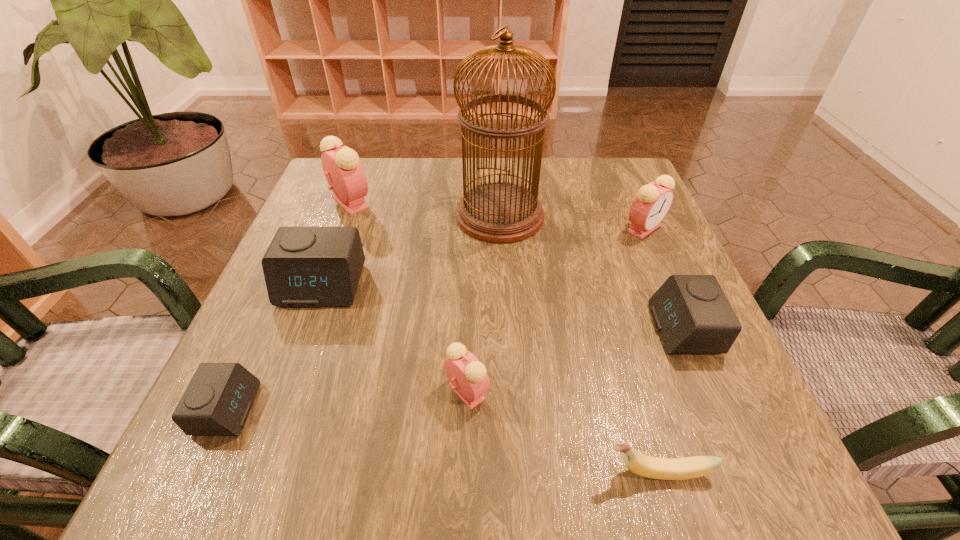
Find the location of a particular element. The image size is (960, 540). object identified as the seventh closest to the nearest object is located at coordinates (344, 173).

Point out which object is positioned as the third nearest to the smallest pink alarm clock. Please provide its 2D coordinates. Your answer should be formatted as a tuple, i.e. [(x, y)], where the tuple contains the x and y coordinates of a point satisfying the conditions above.

[(217, 401)]

Locate an element on the screen. This screenshot has height=540, width=960. alarm clock that is the second closest to the smallest black alarm clock is located at coordinates (469, 380).

Identify which alarm clock is the third nearest to the biggest pink alarm clock. Please provide its 2D coordinates. Your answer should be formatted as a tuple, i.e. [(x, y)], where the tuple contains the x and y coordinates of a point satisfying the conditions above.

[(469, 380)]

Locate which pink alarm clock ranks second in proximity to the rightmost pink alarm clock. Please provide its 2D coordinates. Your answer should be formatted as a tuple, i.e. [(x, y)], where the tuple contains the x and y coordinates of a point satisfying the conditions above.

[(344, 173)]

The width and height of the screenshot is (960, 540). I want to click on pink alarm clock that is the third closest to the birdcage, so click(469, 380).

Select which black alarm clock is the second closest to the second smallest pink alarm clock. Please provide its 2D coordinates. Your answer should be formatted as a tuple, i.e. [(x, y)], where the tuple contains the x and y coordinates of a point satisfying the conditions above.

[(303, 266)]

Point out which black alarm clock is positioned as the nearest to the biggest black alarm clock. Please provide its 2D coordinates. Your answer should be formatted as a tuple, i.e. [(x, y)], where the tuple contains the x and y coordinates of a point satisfying the conditions above.

[(217, 401)]

The image size is (960, 540). What are the coordinates of `free spot that satisfies the following two spatial constraints: 1. on the front-facing side of the biggest black alarm clock; 2. on the front-facing side of the shortest alarm clock` in the screenshot? It's located at (276, 409).

Locate an element on the screen. The height and width of the screenshot is (540, 960). blank area in the image that satisfies the following two spatial constraints: 1. on the face of the sixth shortest object; 2. on the front-facing side of the shortest alarm clock is located at coordinates (723, 409).